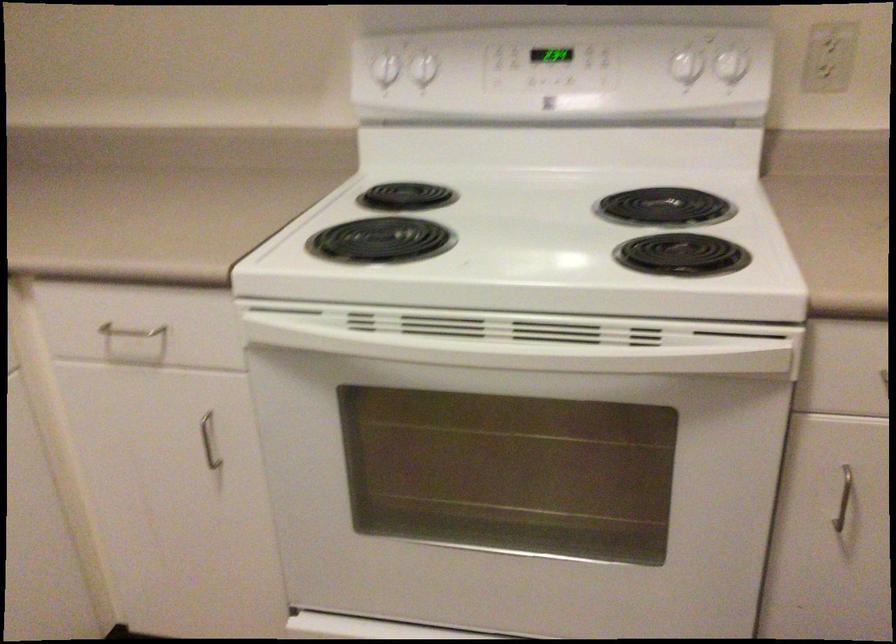
This screenshot has width=896, height=644. What do you see at coordinates (136, 337) in the screenshot? I see `a drawer handle` at bounding box center [136, 337].